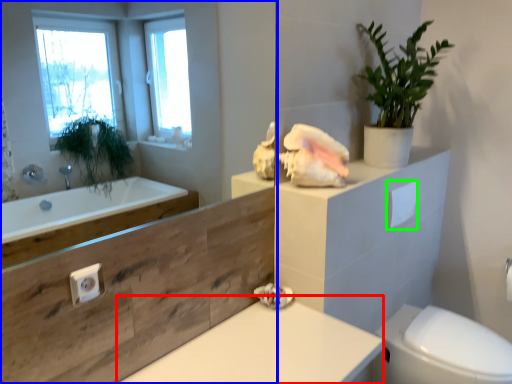
Question: Which is farther away from counter top (highlighted by a red box)? mirror (highlighted by a blue box) or toilet paper (highlighted by a green box)?

Choices:
 (A) mirror
 (B) toilet paper

Answer: (A)